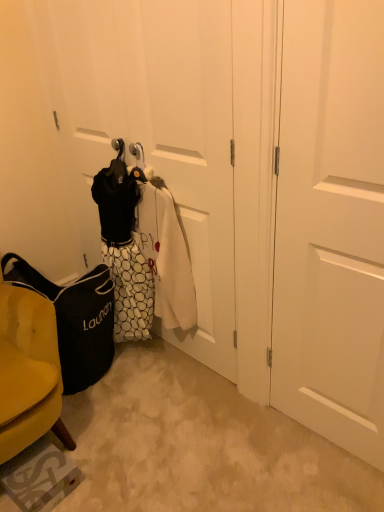
Question: Is point (89, 296) closer or farther from the camera than point (145, 252)?

Choices:
 (A) closer
 (B) farther

Answer: (A)

Question: Is black fabric laundry bag at lower left inside the boundaries of white dotted fabric laundry at center, or outside?

Choices:
 (A) outside
 (B) inside

Answer: (A)

Question: Which is farther from the black fabric laundry bag at lower left?

Choices:
 (A) white matte door at center right
 (B) white dotted fabric laundry at center

Answer: (A)

Question: Based on their relative distances, which object is farther from the white dotted fabric laundry at center?

Choices:
 (A) black fabric laundry bag at lower left
 (B) white matte door at center right

Answer: (B)